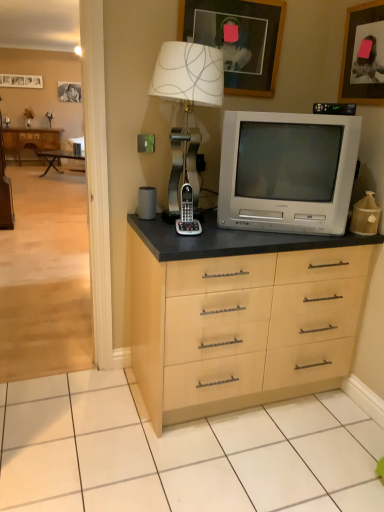
Question: Looking at the image, does satin silver table lamp at upper center seem bigger or smaller compared to brown wood desk at left?

Choices:
 (A) small
 (B) big

Answer: (A)

Question: From a real-world perspective, is satin silver table lamp at upper center positioned above or below brown wood desk at left?

Choices:
 (A) below
 (B) above

Answer: (B)

Question: Which object is positioned closest to the light wood floor at left?

Choices:
 (A) silver metallic television at center
 (B) wooden photo frame at upper left, which is the third picture frame in right-to-left order
 (C) brown wood desk at left
 (D) satin silver table lamp at upper center
 (E) matte gray speaker at left

Answer: (C)

Question: Estimate the real-world distances between objects in this image. Which object is closer to the gray plastic phone at center?

Choices:
 (A) satin silver table lamp at upper center
 (B) light wood floor at left
 (C) wooden picture frame at upper right, the 1th picture frame in the front-to-back sequence
 (D) silver metallic television at center
 (E) brown wood desk at left

Answer: (A)